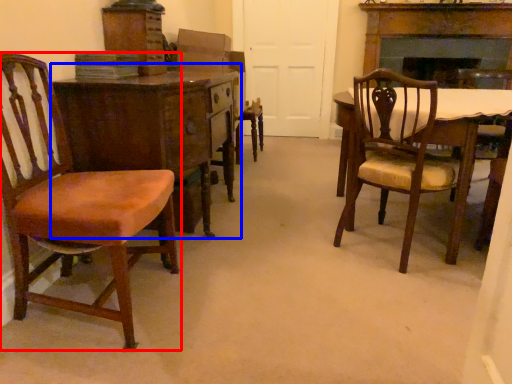
Question: Among these objects, which one is nearest to the camera, chair (highlighted by a red box) or desk (highlighted by a blue box)?

Choices:
 (A) chair
 (B) desk

Answer: (A)